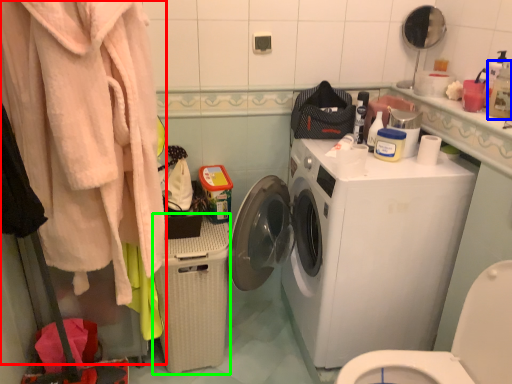
Question: Estimate the real-world distances between objects in this image. Which object is farther from clothing (highlighted by a red box), cleaning product (highlighted by a blue box) or dish washer (highlighted by a green box)?

Choices:
 (A) cleaning product
 (B) dish washer

Answer: (A)